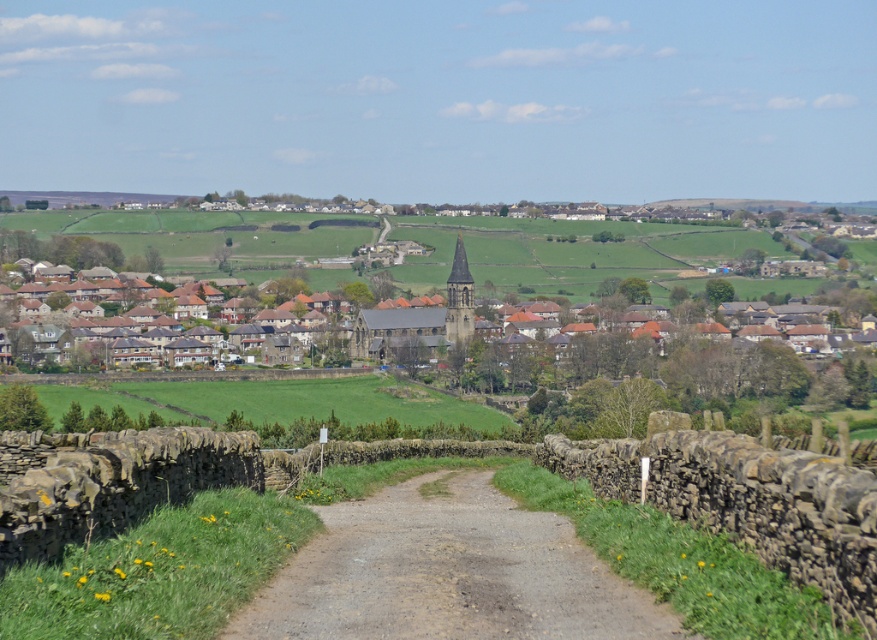
You are standing at a point in the rural landscape and want to determine which of the two points, point (404, 611) or point (379, 337), is nearer to you. Based on the scene description, which point is closer?

Point (404, 611) is closer to the camera than point (379, 337), so it is the nearer one.

You are standing at the entrance of the village and want to see the top of the brown stone church at center. Since the dirt road at center is between you and the church, will the road block your view of the church? Please explain why.

The dirt road at center has a lesser height compared to brown stone church at center, so the road will not block your view of the church because the church is taller.

You are standing at the center of the image and want to walk towards the dirt road at center. In which direction should you move relative to your current position?

Since the dirt road at center is located at the center of the image, you are already at the correct position to reach it. No movement is needed.